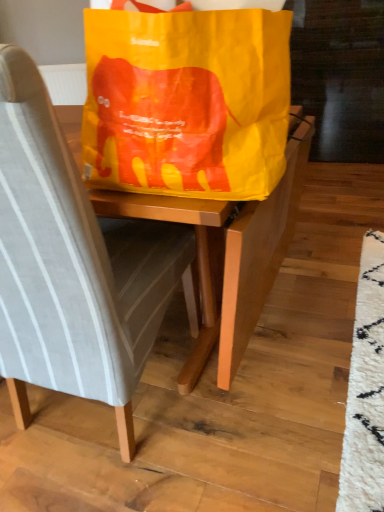
What do you see at coordinates (187, 101) in the screenshot? I see `yellow paper grocery bag at center` at bounding box center [187, 101].

Find the location of a particular element. yellow paper grocery bag at center is located at coordinates (187, 101).

You are a GUI agent. You are given a task and a screenshot of the screen. Output one action in this format:
    pyautogui.click(x=<x>, y=<y>)
    Task: Click on the light gray fabric chair at center
    The height and width of the screenshot is (512, 384).
    Given the screenshot: What is the action you would take?
    pyautogui.click(x=72, y=265)

Describe the element at coordinates (72, 265) in the screenshot. I see `light gray fabric chair at center` at that location.

You are a GUI agent. You are given a task and a screenshot of the screen. Output one action in this format:
    pyautogui.click(x=<x>, y=<y>)
    Task: Click on the yellow paper grocery bag at center
    This screenshot has height=512, width=384.
    Given the screenshot: What is the action you would take?
    pyautogui.click(x=187, y=101)

Between light gray fabric chair at center and yellow paper grocery bag at center, which one appears on the right side from the viewer's perspective?

From the viewer's perspective, yellow paper grocery bag at center appears more on the right side.

From the picture: Is light gray fabric chair at center in front of yellow paper grocery bag at center?

Yes, light gray fabric chair at center is in front of yellow paper grocery bag at center.

Is point (48, 115) positioned in front of point (92, 182)?

Yes, point (48, 115) is in front of point (92, 182).

From the image's perspective, is light gray fabric chair at center below yellow paper grocery bag at center?

Indeed, from the image's perspective, light gray fabric chair at center is shown beneath yellow paper grocery bag at center.

From a real-world perspective, which object stands above the other?

From a 3D spatial view, yellow paper grocery bag at center is above.

Is light gray fabric chair at center wider than yellow paper grocery bag at center?

Indeed, light gray fabric chair at center has a greater width compared to yellow paper grocery bag at center.

Which of these two, light gray fabric chair at center or yellow paper grocery bag at center, stands shorter?

yellow paper grocery bag at center.

Which of these two, light gray fabric chair at center or yellow paper grocery bag at center, is bigger?

Bigger between the two is light gray fabric chair at center.

Choose the correct answer: Is light gray fabric chair at center inside yellow paper grocery bag at center or outside it?

light gray fabric chair at center exists outside the volume of yellow paper grocery bag at center.

Is light gray fabric chair at center far from yellow paper grocery bag at center?

Actually, light gray fabric chair at center and yellow paper grocery bag at center are a little close together.

In the scene shown: Is light gray fabric chair at center aimed at yellow paper grocery bag at center?

No, light gray fabric chair at center is not facing towards yellow paper grocery bag at center.

This screenshot has width=384, height=512. What are the coordinates of `grocery bag behind the light gray fabric chair at center` in the screenshot? It's located at (187, 101).

Is yellow paper grocery bag at center to the left or to the right of light gray fabric chair at center in the image?

In the image, yellow paper grocery bag at center appears on the right side of light gray fabric chair at center.

Does yellow paper grocery bag at center lie in front of light gray fabric chair at center?

No, it is behind light gray fabric chair at center.

Does point (137, 121) appear closer or farther from the camera than point (34, 137)?

Point (137, 121).

From the image's perspective, is yellow paper grocery bag at center located above light gray fabric chair at center?

Yes, from the image's perspective, yellow paper grocery bag at center is on top of light gray fabric chair at center.

From a real-world perspective, which is physically below, yellow paper grocery bag at center or light gray fabric chair at center?

light gray fabric chair at center is physically lower.

Consider the image. Considering the sizes of objects yellow paper grocery bag at center and light gray fabric chair at center in the image provided, who is wider, yellow paper grocery bag at center or light gray fabric chair at center?

light gray fabric chair at center.

Which of these two, yellow paper grocery bag at center or light gray fabric chair at center, stands shorter?

yellow paper grocery bag at center.

Does yellow paper grocery bag at center have a larger size compared to light gray fabric chair at center?

No, yellow paper grocery bag at center is not bigger than light gray fabric chair at center.

Could light gray fabric chair at center be considered to be inside yellow paper grocery bag at center?

No, light gray fabric chair at center is not inside yellow paper grocery bag at center.

Is the surface of yellow paper grocery bag at center in direct contact with light gray fabric chair at center?

No, yellow paper grocery bag at center is not next to light gray fabric chair at center.

Could you tell me if yellow paper grocery bag at center is turned towards light gray fabric chair at center?

Yes.

How different are the orientations of yellow paper grocery bag at center and light gray fabric chair at center in degrees?

The facing directions of yellow paper grocery bag at center and light gray fabric chair at center are 84.9 degrees apart.

How much distance is there between yellow paper grocery bag at center and light gray fabric chair at center?

A distance of 11.50 inches exists between yellow paper grocery bag at center and light gray fabric chair at center.

This screenshot has height=512, width=384. In the image, there is a light gray fabric chair at center. Find the location of `grocery bag above it (from the image's perspective)`. grocery bag above it (from the image's perspective) is located at coordinates (187, 101).

This screenshot has width=384, height=512. I want to click on chair on the left of yellow paper grocery bag at center, so click(72, 265).

Where is `grocery bag behind the light gray fabric chair at center`? The image size is (384, 512). grocery bag behind the light gray fabric chair at center is located at coordinates (187, 101).